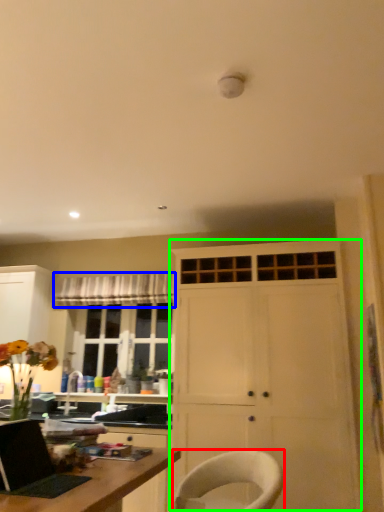
Question: Which is nearer to the chair (highlighted by a red box)? curtain (highlighted by a blue box) or cabinetry (highlighted by a green box).

Choices:
 (A) curtain
 (B) cabinetry

Answer: (B)